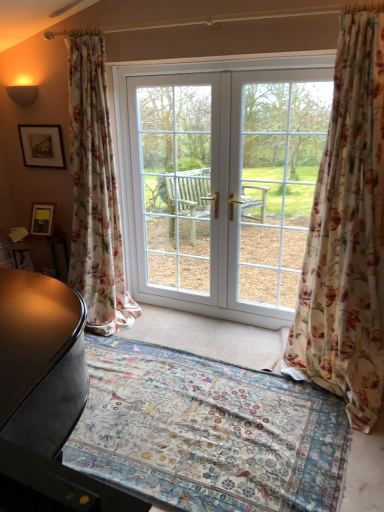
Question: From a real-world perspective, is white glossy door at center physically below floral fabric curtain at left, placed as the 1th curtain when sorted from left to right?

Choices:
 (A) yes
 (B) no

Answer: (A)

Question: From the image's perspective, does white glossy door at center appear higher than floral fabric curtain at left, which is counted as the second curtain, starting from the right?

Choices:
 (A) yes
 (B) no

Answer: (B)

Question: Considering the relative sizes of white glossy door at center and floral fabric curtain at left, placed as the 1th curtain when sorted from left to right, in the image provided, is white glossy door at center smaller than floral fabric curtain at left, placed as the 1th curtain when sorted from left to right,?

Choices:
 (A) yes
 (B) no

Answer: (A)

Question: Considering the relative sizes of white glossy door at center and floral fabric curtain at left, placed as the 1th curtain when sorted from left to right, in the image provided, is white glossy door at center thinner than floral fabric curtain at left, placed as the 1th curtain when sorted from left to right,?

Choices:
 (A) yes
 (B) no

Answer: (A)

Question: Can we say white glossy door at center lies outside floral fabric curtain at left, placed as the 1th curtain when sorted from left to right?

Choices:
 (A) no
 (B) yes

Answer: (B)

Question: Considering the relative sizes of white glossy door at center and floral fabric curtain at left, placed as the 1th curtain when sorted from left to right, in the image provided, is white glossy door at center wider than floral fabric curtain at left, placed as the 1th curtain when sorted from left to right,?

Choices:
 (A) yes
 (B) no

Answer: (B)

Question: Is floral carpet at center further to camera compared to white glass door at center?

Choices:
 (A) no
 (B) yes

Answer: (A)

Question: Is floral carpet at center beside white glass door at center?

Choices:
 (A) yes
 (B) no

Answer: (B)

Question: Considering the relative sizes of floral carpet at center and white glass door at center in the image provided, is floral carpet at center wider than white glass door at center?

Choices:
 (A) yes
 (B) no

Answer: (A)

Question: From the image's perspective, is floral carpet at center on white glass door at center?

Choices:
 (A) no
 (B) yes

Answer: (A)

Question: Can you confirm if floral carpet at center is thinner than white glass door at center?

Choices:
 (A) yes
 (B) no

Answer: (B)

Question: Is floral carpet at center taller than white glass door at center?

Choices:
 (A) no
 (B) yes

Answer: (A)

Question: Does floral fabric curtain at right, which ranks as the second curtain in left-to-right order, appear on the left side of floral carpet at center?

Choices:
 (A) no
 (B) yes

Answer: (A)